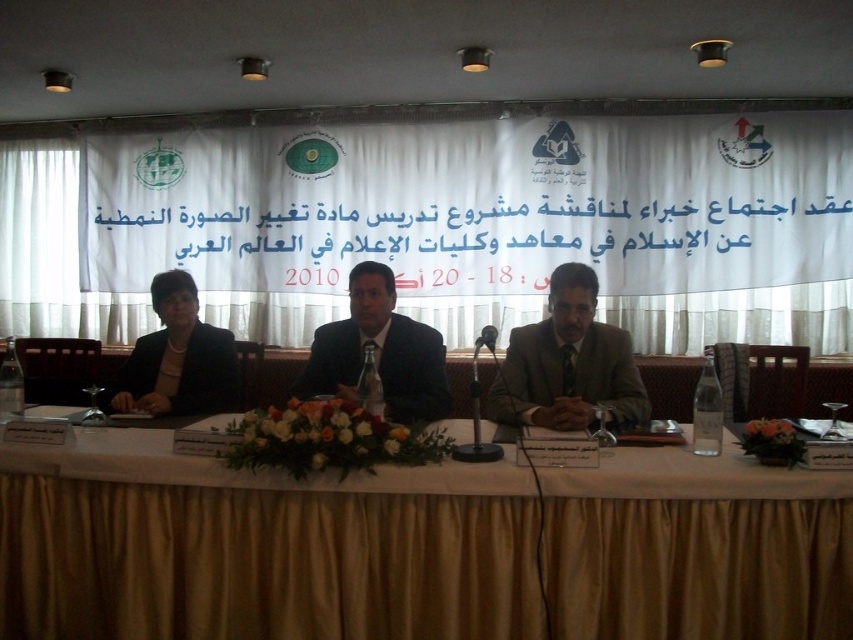
Question: Which point is farther from the camera taking this photo?

Choices:
 (A) (814, 556)
 (B) (611, 346)
 (C) (112, 392)

Answer: (C)

Question: Can you confirm if dark blue suit at center is thinner than black matte suit at left?

Choices:
 (A) yes
 (B) no

Answer: (B)

Question: Which point appears farthest from the camera in this image?

Choices:
 (A) (525, 342)
 (B) (54, 410)

Answer: (B)

Question: Observing the image, what is the correct spatial positioning of white fabric table at center in reference to dark blue suit at center?

Choices:
 (A) left
 (B) right

Answer: (B)

Question: Which point is closer to the camera?

Choices:
 (A) (177, 410)
 (B) (352, 368)

Answer: (B)

Question: Can you confirm if matte brown suit at center is wider than black matte suit at left?

Choices:
 (A) no
 (B) yes

Answer: (B)